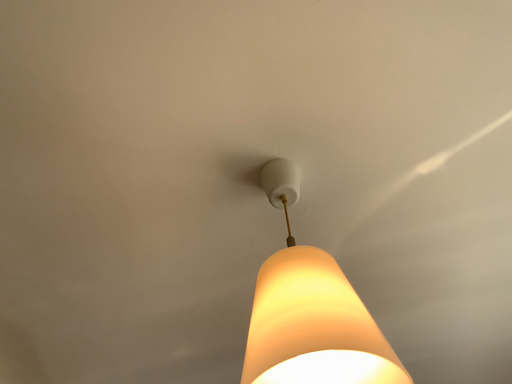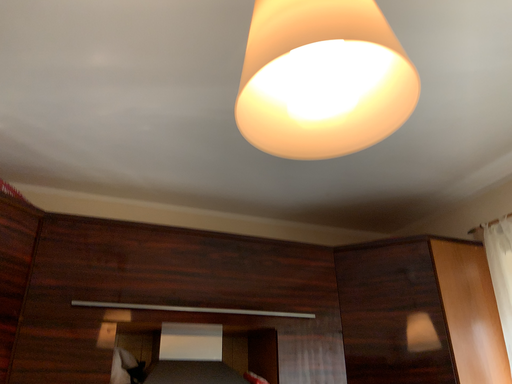
Question: How did the camera likely rotate when shooting the video?

Choices:
 (A) rotated right
 (B) rotated left

Answer: (A)